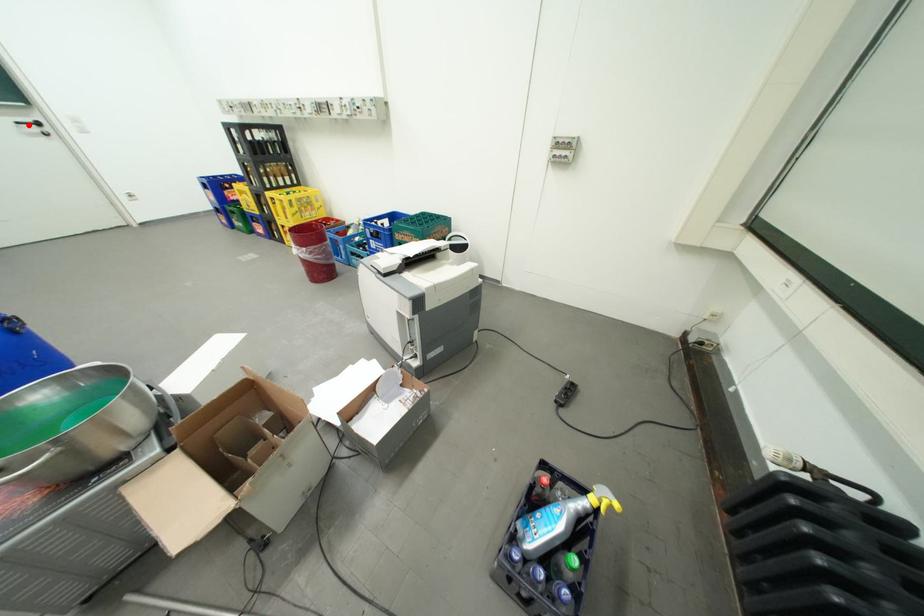
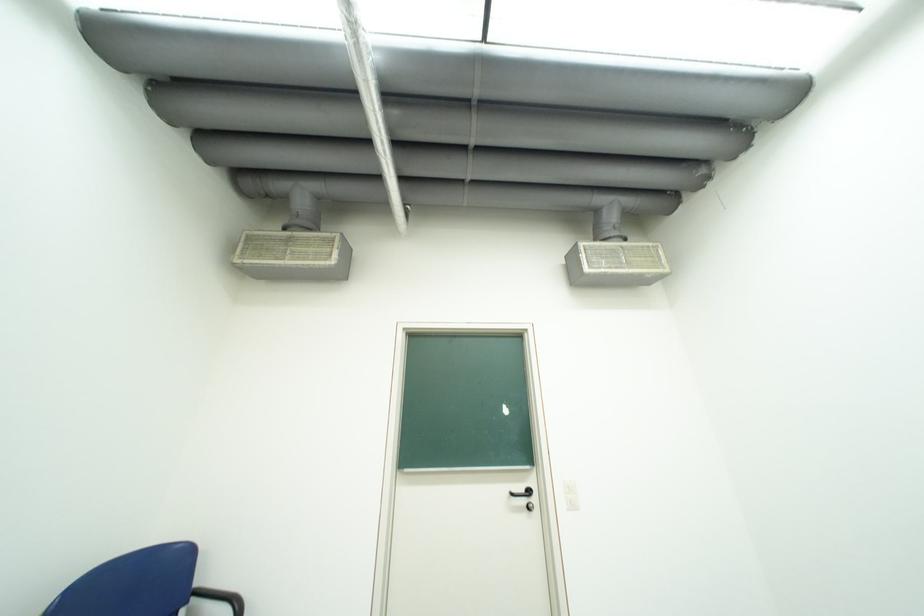
Question: I am providing you with two images of the same scene from different viewpoints. A red point is marked on the first image. At the location where the point appears in image 1, is it still visible in image 2?

Choices:
 (A) Yes
 (B) No

Answer: (A)